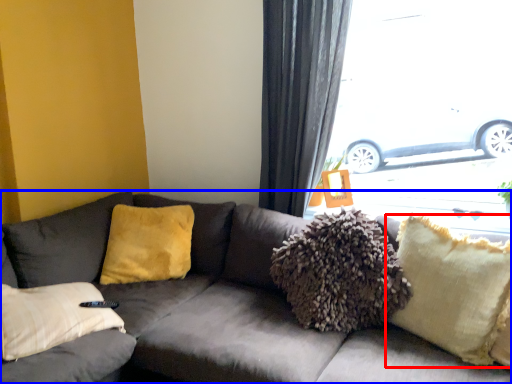
Question: Which object appears closest to the camera in this image, pillow (highlighted by a red box) or studio couch (highlighted by a blue box)?

Choices:
 (A) pillow
 (B) studio couch

Answer: (B)